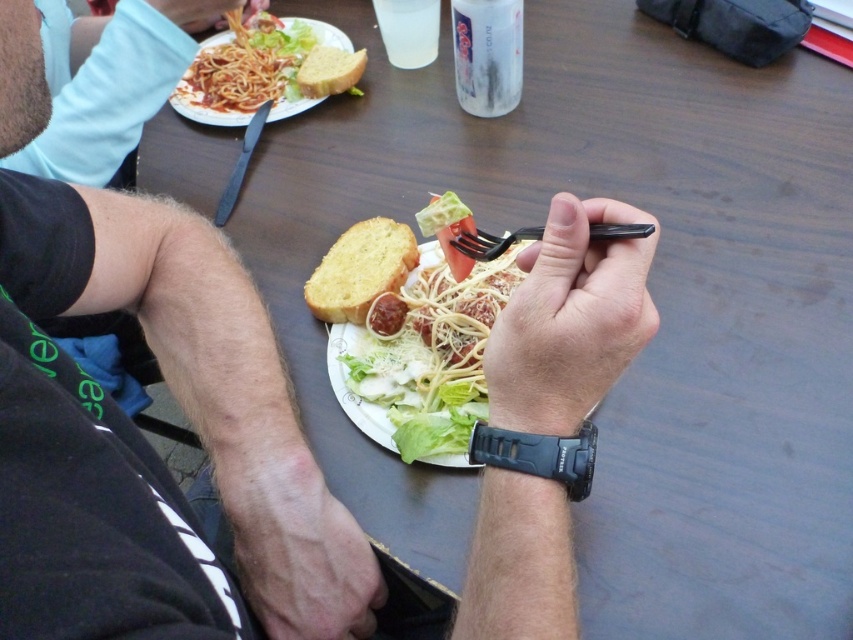
Can you confirm if matte black fork at center is positioned above brown toasted bread at upper center?

Actually, matte black fork at center is below brown toasted bread at upper center.

Between matte black fork at center and brown toasted bread at upper center, which one is positioned lower?

matte black fork at center

Between point (506, 353) and point (328, 68), which one is positioned in front?

Point (506, 353) is more forward.

At what (x,y) coordinates should I click in order to perform the action: click on matte black fork at center. Please return your answer as a coordinate pair (x, y). The width and height of the screenshot is (853, 640). Looking at the image, I should click on (569, 320).

This screenshot has height=640, width=853. Describe the element at coordinates (569, 320) in the screenshot. I see `matte black fork at center` at that location.

Who is higher up, matte black fork at center or white matte spaghetti at center?

matte black fork at center

Locate an element on the screen. Image resolution: width=853 pixels, height=640 pixels. matte black fork at center is located at coordinates (569, 320).

Can you confirm if white paper plate at upper left is positioned to the right of brown toasted bread at upper center?

Incorrect, white paper plate at upper left is not on the right side of brown toasted bread at upper center.

What do you see at coordinates (206, 113) in the screenshot? I see `white paper plate at upper left` at bounding box center [206, 113].

Locate an element on the screen. The width and height of the screenshot is (853, 640). white paper plate at upper left is located at coordinates (206, 113).